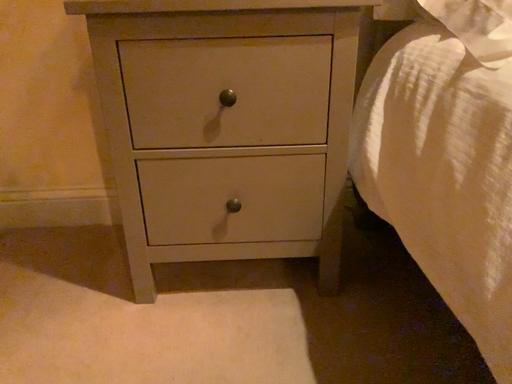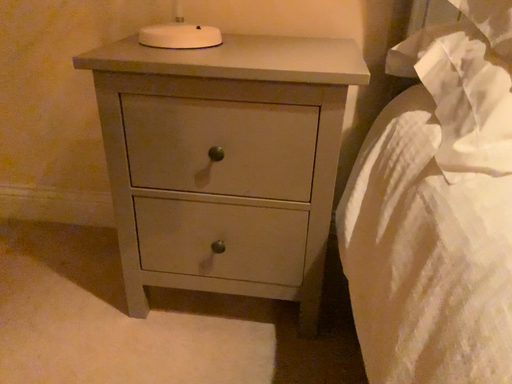
Question: How did the camera likely rotate when shooting the video?

Choices:
 (A) rotated left
 (B) rotated right

Answer: (A)